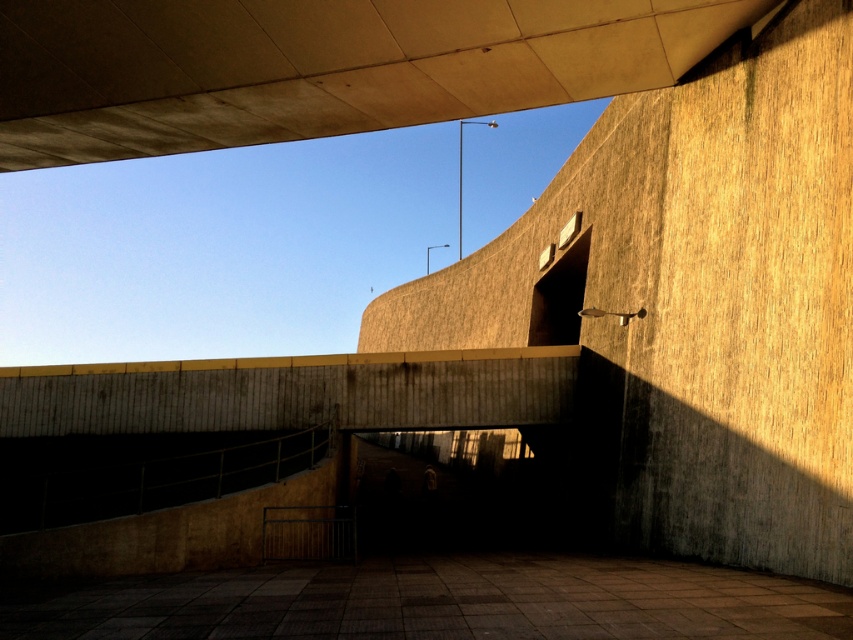
Who is taller, concrete ceiling at upper center or brown concrete at center?

Standing taller between the two is brown concrete at center.

How much distance is there between concrete ceiling at upper center and brown concrete at center?

concrete ceiling at upper center is 8.48 meters from brown concrete at center.

The width and height of the screenshot is (853, 640). Find the location of `concrete ceiling at upper center`. concrete ceiling at upper center is located at coordinates (318, 65).

The height and width of the screenshot is (640, 853). Find the location of `concrete ceiling at upper center`. concrete ceiling at upper center is located at coordinates (318, 65).